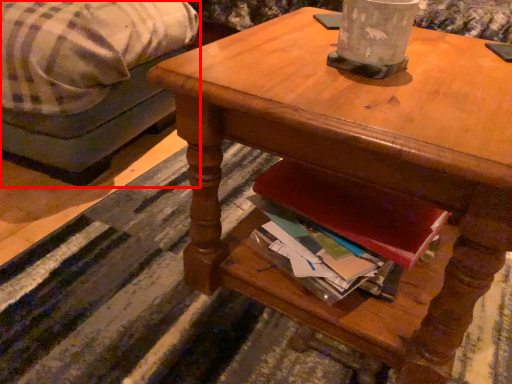
Question: From the image, what is the correct spatial relationship of studio couch (annotated by the red box) in relation to desk?

Choices:
 (A) left
 (B) right

Answer: (A)